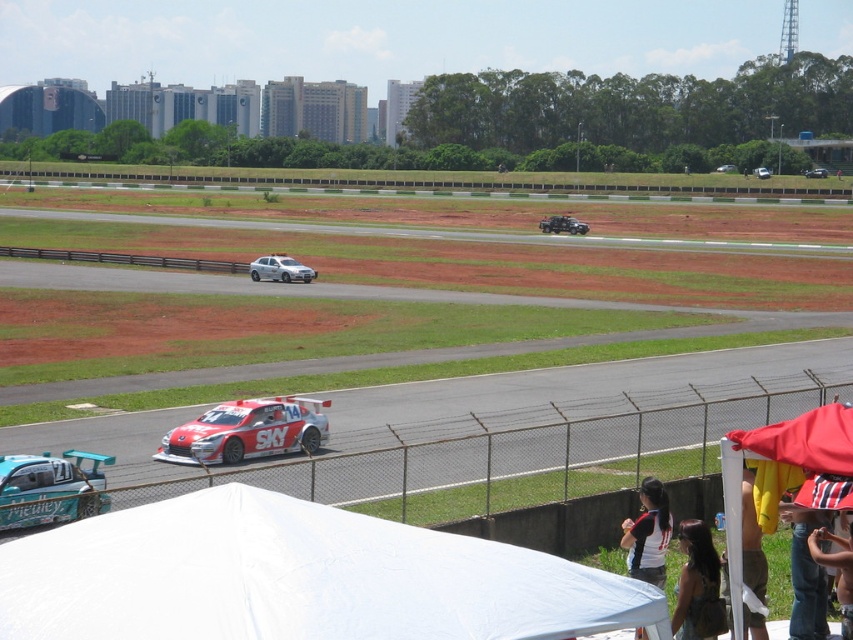
Question: Does white fabric canopy at lower center have a greater width compared to silver metallic sedan at center?

Choices:
 (A) yes
 (B) no

Answer: (A)

Question: Which point is farther to the camera?

Choices:
 (A) (721, 168)
 (B) (270, 406)
 (C) (268, 257)

Answer: (A)

Question: Which of the following is the farthest from the observer?

Choices:
 (A) (541, 228)
 (B) (274, 275)

Answer: (A)

Question: Is teal matte race car at lower left to the left of matte black car at center from the viewer's perspective?

Choices:
 (A) no
 (B) yes

Answer: (B)

Question: Is shiny metallic race car at center positioned at the back of white glossy sedan at center?

Choices:
 (A) yes
 (B) no

Answer: (B)

Question: Which point appears farthest from the camera in this image?

Choices:
 (A) tap(757, 170)
 (B) tap(80, 611)
 (C) tap(808, 170)

Answer: (C)